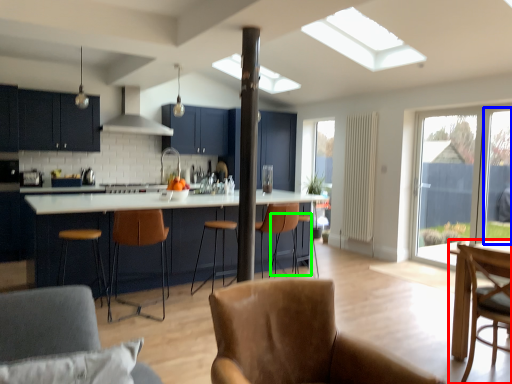
Question: Estimate the real-world distances between objects in this image. Which object is farther from chair (highlighted by a red box), window screen (highlighted by a blue box) or bar stool (highlighted by a green box)?

Choices:
 (A) window screen
 (B) bar stool

Answer: (A)